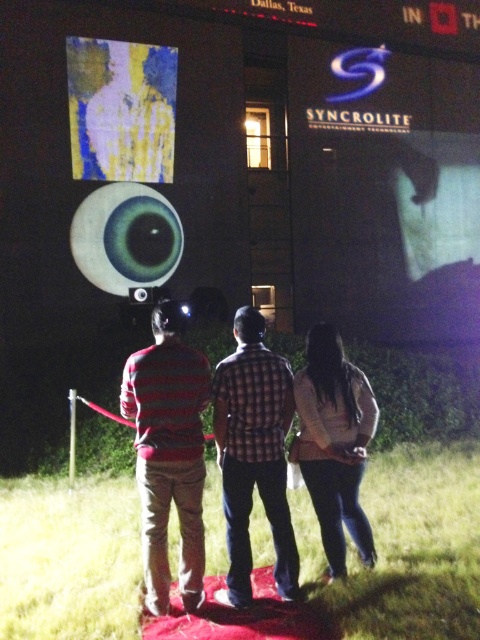
You are organizing a photo shoot and need to ensure that the striped sweater at center and the yellow fabric at upper left are both visible in the frame. Given that the camera has a fixed focal length, which object should you prioritize positioning closer to the camera to ensure both fit in the frame?

The striped sweater at center has a smaller width than the yellow fabric at upper left. To ensure both fit in the frame, prioritize positioning the wider yellow fabric at upper left closer to the camera since it requires more space due to its greater width.

You are standing in the outdoor nighttime scene with the three individuals on the red carpet. You notice two points marked on the screen. The first point is at coordinate point(280, 467) and the second is at point(360, 545). From your perspective, which point is closer to you?

Point(280, 467) is in front of point(360, 545), so it is closer to you.

You are an event photographer at the SYNCROLITE exhibition. You need to capture a photo that includes both the striped sweater at center and the yellow fabric at upper left. Based on their positions and sizes, which object should you focus on first to ensure both are in frame?

The striped sweater at center is shorter than the yellow fabric at upper left. To ensure both are in frame, focus on the yellow fabric at upper left first since it is taller and requires more vertical space.